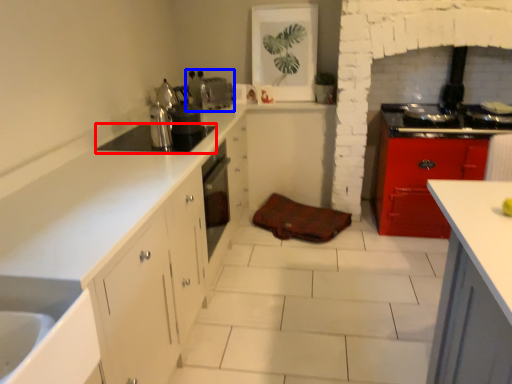
Question: Which of the following is the farthest to the observer, appliance (highlighted by a red box) or appliance (highlighted by a blue box)?

Choices:
 (A) appliance
 (B) appliance

Answer: (B)